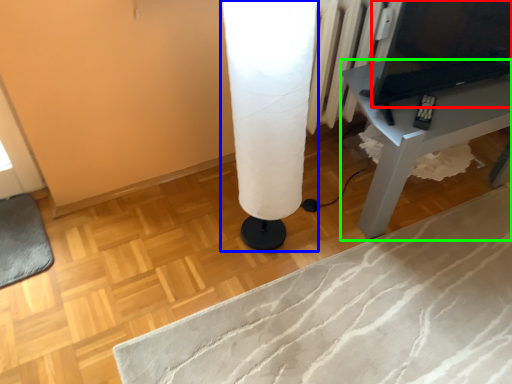
Question: Which object is positioned closest to computer (highlighted by a red box)? Select from table lamp (highlighted by a blue box) and table (highlighted by a green box).

Choices:
 (A) table lamp
 (B) table

Answer: (B)